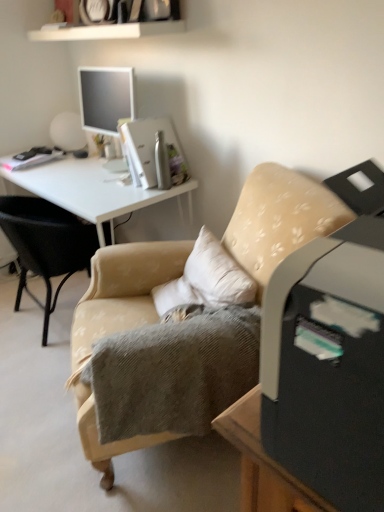
Question: From the image's perspective, does beige fabric chair at center, which ranks as the 1th chair in right-to-left order, appear lower than white glossy desk at upper left?

Choices:
 (A) no
 (B) yes

Answer: (B)

Question: Is beige fabric chair at center, marked as the second chair in a left-to-right arrangement, positioned before white glossy desk at upper left?

Choices:
 (A) yes
 (B) no

Answer: (A)

Question: Is beige fabric chair at center, which ranks as the 1th chair in right-to-left order, looking in the opposite direction of white glossy desk at upper left?

Choices:
 (A) yes
 (B) no

Answer: (B)

Question: Is beige fabric chair at center, marked as the second chair in a left-to-right arrangement, at the left side of white glossy desk at upper left?

Choices:
 (A) no
 (B) yes

Answer: (A)

Question: From the image's perspective, would you say beige fabric chair at center, which ranks as the 1th chair in right-to-left order, is positioned over white glossy desk at upper left?

Choices:
 (A) yes
 (B) no

Answer: (B)

Question: Is beige fabric chair at center, marked as the second chair in a left-to-right arrangement, not near white glossy desk at upper left?

Choices:
 (A) yes
 (B) no

Answer: (B)

Question: From a real-world perspective, is beige fabric chair at center, which appears as the 2th chair when viewed from the right, positioned under beige fabric chair at center, marked as the second chair in a left-to-right arrangement, based on gravity?

Choices:
 (A) yes
 (B) no

Answer: (A)

Question: Considering the relative sizes of beige fabric chair at center, which ranks as the first chair in left-to-right order, and beige fabric chair at center, marked as the second chair in a left-to-right arrangement, in the image provided, is beige fabric chair at center, which ranks as the first chair in left-to-right order, bigger than beige fabric chair at center, marked as the second chair in a left-to-right arrangement,?

Choices:
 (A) no
 (B) yes

Answer: (A)

Question: From a real-world perspective, is beige fabric chair at center, which appears as the 2th chair when viewed from the right, over beige fabric chair at center, marked as the second chair in a left-to-right arrangement?

Choices:
 (A) no
 (B) yes

Answer: (A)

Question: Considering the relative sizes of beige fabric chair at center, which ranks as the first chair in left-to-right order, and beige fabric chair at center, marked as the second chair in a left-to-right arrangement, in the image provided, is beige fabric chair at center, which ranks as the first chair in left-to-right order, shorter than beige fabric chair at center, marked as the second chair in a left-to-right arrangement,?

Choices:
 (A) no
 (B) yes

Answer: (B)

Question: Is beige fabric chair at center, which appears as the 2th chair when viewed from the right, at the left side of beige fabric chair at center, which ranks as the 1th chair in right-to-left order?

Choices:
 (A) no
 (B) yes

Answer: (B)

Question: Considering the relative sizes of beige fabric chair at center, which appears as the 2th chair when viewed from the right, and beige fabric chair at center, marked as the second chair in a left-to-right arrangement, in the image provided, is beige fabric chair at center, which appears as the 2th chair when viewed from the right, wider than beige fabric chair at center, marked as the second chair in a left-to-right arrangement,?

Choices:
 (A) no
 (B) yes

Answer: (A)

Question: Is white glossy desk at upper left touching beige fabric chair at center, which ranks as the first chair in left-to-right order?

Choices:
 (A) yes
 (B) no

Answer: (B)